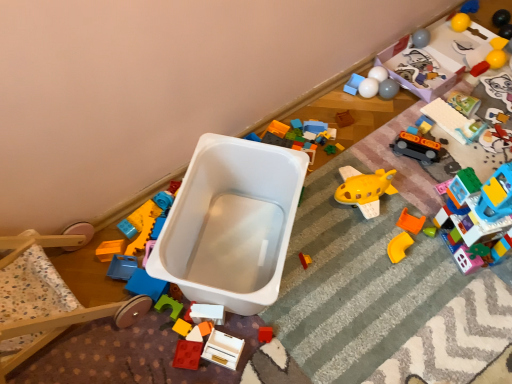
You are a GUI agent. You are given a task and a screenshot of the screen. Output one action in this format:
    pyautogui.click(x=<x>, y=<y>)
    Task: Click on the vacant space that's between matte yellow toy airplane at center, arranged as the 5th toy when viewed from the left, and white plastic baby carriage at center
    This screenshot has height=384, width=512.
    Given the screenshot: What is the action you would take?
    pyautogui.click(x=297, y=263)